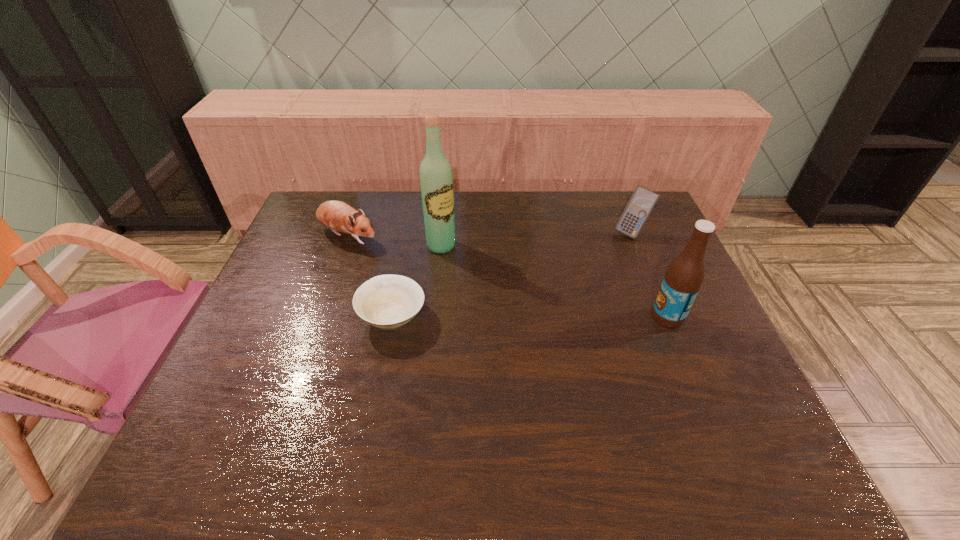
At what (x,y) coordinates should I click in order to perform the action: click on the shortest object. Please return your answer as a coordinate pair (x, y). The height and width of the screenshot is (540, 960). Looking at the image, I should click on (389, 301).

This screenshot has height=540, width=960. In order to click on the fourth shortest object in this screenshot , I will do `click(684, 276)`.

Identify the location of wine bottle. This screenshot has width=960, height=540. (436, 180).

What are the coordinates of `calculator` in the screenshot? It's located at (642, 202).

Locate an element on the screen. hamster is located at coordinates (338, 216).

You are a GUI agent. You are given a task and a screenshot of the screen. Output one action in this format:
    pyautogui.click(x=<x>, y=<y>)
    Task: Click on the free space located 0.400m on the right of the shortest object
    
    Given the screenshot: What is the action you would take?
    pyautogui.click(x=578, y=317)

Identify the location of vacant position located 0.070m on the front of the second tallest object. The width and height of the screenshot is (960, 540). (682, 350).

Image resolution: width=960 pixels, height=540 pixels. I want to click on vacant space situated 0.200m on the front-facing side of the tallest object, so click(491, 289).

Where is `vacant region located 0.100m on the front-facing side of the tallest object`? vacant region located 0.100m on the front-facing side of the tallest object is located at coordinates (469, 270).

This screenshot has width=960, height=540. Find the location of `free space located 0.380m on the front-facing side of the tallest object`. free space located 0.380m on the front-facing side of the tallest object is located at coordinates (535, 327).